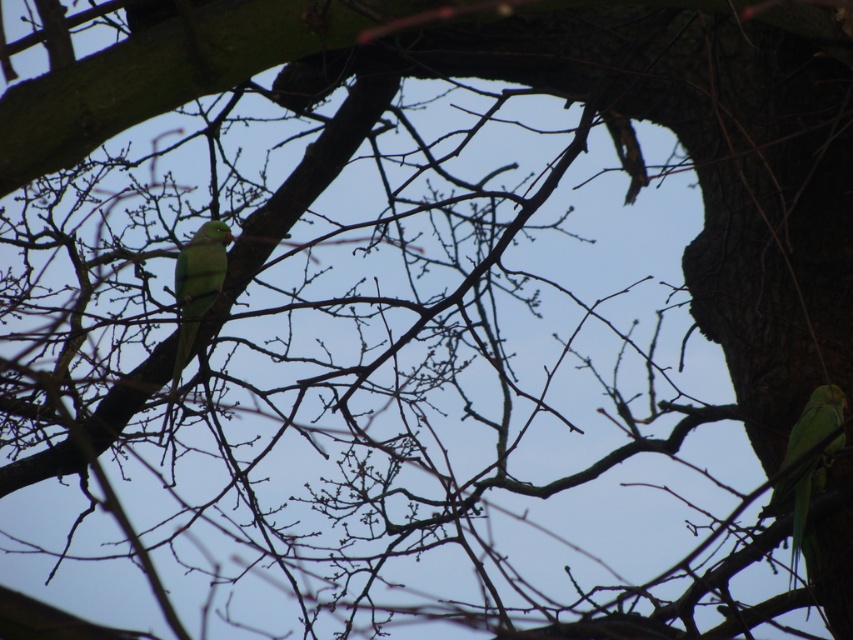
At what (x,y) coordinates should I click in order to perform the action: click on green matte parrot at right. Please return your answer as a coordinate pair (x, y). Looking at the image, I should click on (801, 490).

Image resolution: width=853 pixels, height=640 pixels. What do you see at coordinates (801, 490) in the screenshot?
I see `green matte parrot at right` at bounding box center [801, 490].

Where is `green matte parrot at right`? The image size is (853, 640). green matte parrot at right is located at coordinates coord(801,490).